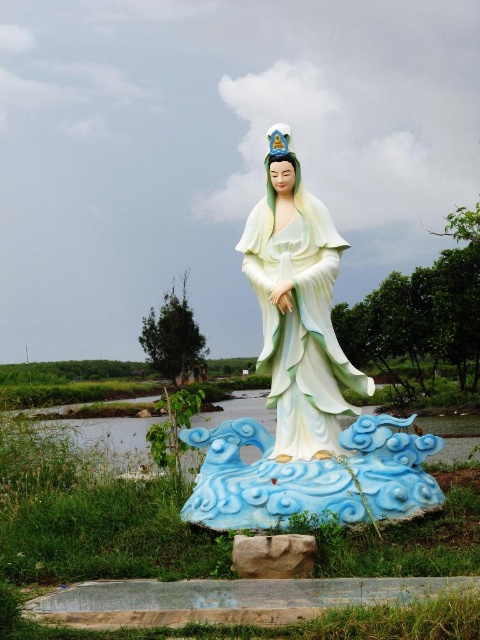
What do you see at coordinates (303, 387) in the screenshot? I see `white glossy statue at center` at bounding box center [303, 387].

I want to click on white glossy statue at center, so click(x=303, y=387).